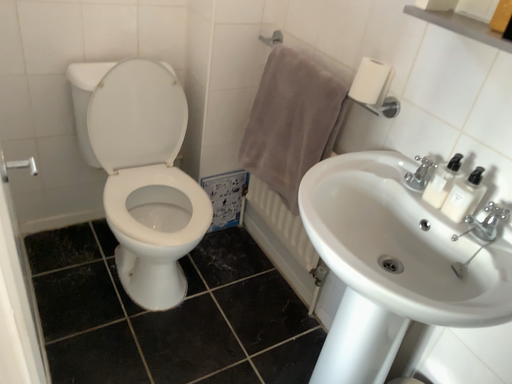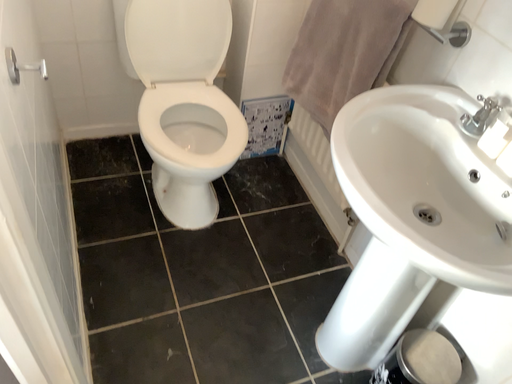
Question: How did the camera likely rotate when shooting the video?

Choices:
 (A) rotated left
 (B) rotated right

Answer: (A)